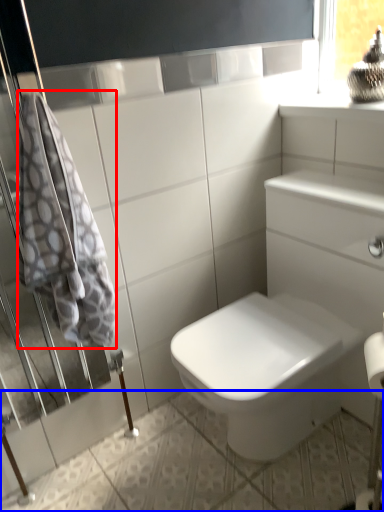
Question: Among these objects, which one is nearest to the camera, bath towel (highlighted by a red box) or ceramic tile (highlighted by a blue box)?

Choices:
 (A) bath towel
 (B) ceramic tile

Answer: (B)